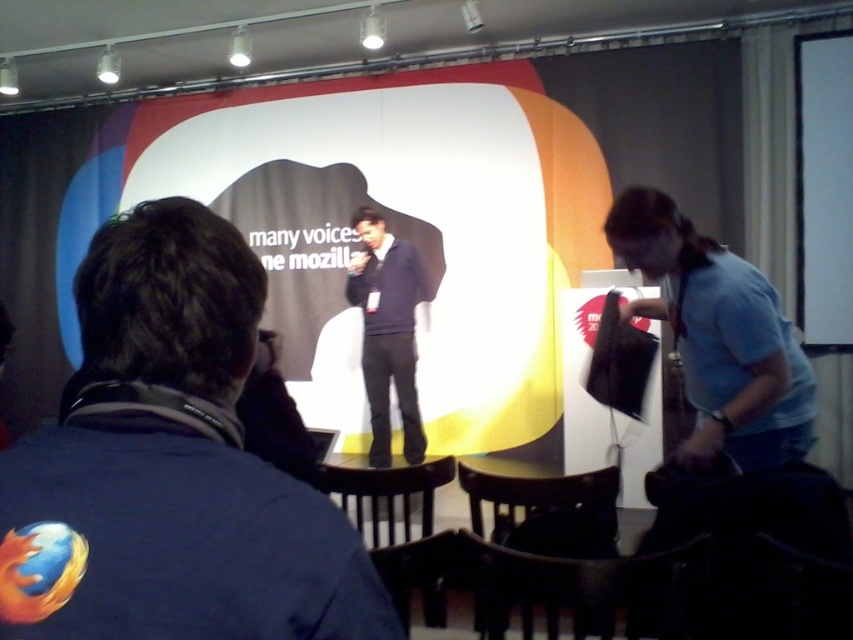
Does blue denim jacket at center lie behind dark blue sweater at center?

No, blue denim jacket at center is closer to the viewer.

Is blue denim jacket at center to the right of dark blue sweater at center from the viewer's perspective?

Indeed, blue denim jacket at center is positioned on the right side of dark blue sweater at center.

Image resolution: width=853 pixels, height=640 pixels. What do you see at coordinates (181, 458) in the screenshot?
I see `blue denim jacket at center` at bounding box center [181, 458].

Locate an element on the screen. blue denim jacket at center is located at coordinates (181, 458).

Between light blue fabric shirt at right and dark blue sweater at center, which one has more height?

With more height is dark blue sweater at center.

Is light blue fabric shirt at right positioned in front of dark blue sweater at center?

Yes, light blue fabric shirt at right is closer to the viewer.

Is point (612, 243) in front of point (384, 250)?

Yes, it is.

In order to click on light blue fabric shirt at right in this screenshot , I will do `click(718, 337)`.

Between point (126, 605) and point (700, 252), which one is positioned in front?

Point (126, 605) is in front.

This screenshot has width=853, height=640. Describe the element at coordinates (181, 458) in the screenshot. I see `blue denim jacket at center` at that location.

Is point (189, 566) behind point (689, 307)?

No, (189, 566) is closer to viewer.

Find the location of `blue denim jacket at center`. blue denim jacket at center is located at coordinates (181, 458).